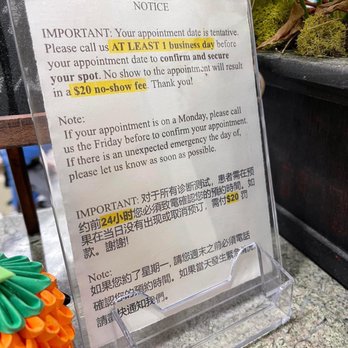
Find the location of a particular element. The image size is (348, 348). table is located at coordinates (295, 331).